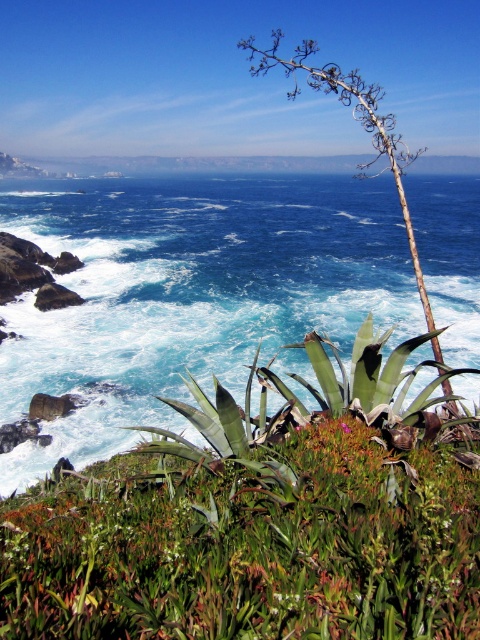
You are a hiker who has just arrived at this coastal area and wants to take a photo of both the green leafy plant at center and the blue liquid water at center. Since you want both to be clearly visible in the frame, which object should you focus on first to ensure proper focus?

You should focus on the green leafy plant at center first because it is smaller in size compared to the blue liquid water at center, so capturing its details requires precise focus.

You are a botanist studying the coastal flora. You have a map of the area with coordinates. According to the map, where is the green leafy plant at center located?

The green leafy plant at center is located at coordinates point (x=259, y=522).